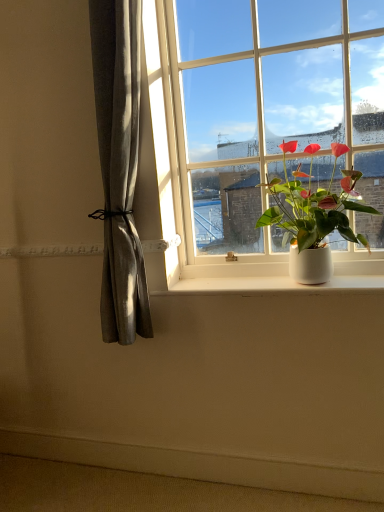
The width and height of the screenshot is (384, 512). Find the location of `white glossy window at upper center`. white glossy window at upper center is located at coordinates (252, 120).

Find the location of `green matte plant at right`. green matte plant at right is located at coordinates (313, 214).

Image resolution: width=384 pixels, height=512 pixels. Find the location of `white smooth ledge at lower center`. white smooth ledge at lower center is located at coordinates (200, 465).

At what (x,y) coordinates should I click in order to perform the action: click on white smooth window sill at lower center. Please return your answer as a coordinate pair (x, y). The height and width of the screenshot is (512, 384). Looking at the image, I should click on (275, 284).

At what (x,y) coordinates should I click in order to perform the action: click on white glossy window at upper center. Please return your answer as a coordinate pair (x, y). The height and width of the screenshot is (512, 384). Looking at the image, I should click on (252, 120).

Is white smooth ledge at lower center outside of white glossy window at upper center?

Yes.

Are white smooth ledge at lower center and white glossy window at upper center far apart?

Yes, white smooth ledge at lower center is far from white glossy window at upper center.

Is white smooth ledge at lower center facing towards white glossy window at upper center?

No, white smooth ledge at lower center does not turn towards white glossy window at upper center.

What are the coordinates of `window in front of the white smooth ledge at lower center` in the screenshot? It's located at 252,120.

Can we say white glossy window at upper center lies outside white smooth ledge at lower center?

Yes, white glossy window at upper center is located beyond the bounds of white smooth ledge at lower center.

Which object is positioned more to the left, white glossy window at upper center or white smooth ledge at lower center?

From the viewer's perspective, white smooth ledge at lower center appears more on the left side.

Could you tell me if white glossy window at upper center is turned towards white smooth ledge at lower center?

No.

From the image's perspective, is white glossy window at upper center on top of white smooth ledge at lower center?

Yes, from the image's perspective, white glossy window at upper center is over white smooth ledge at lower center.

Is white smooth window sill at lower center located outside white glossy window at upper center?

white smooth window sill at lower center is positioned outside white glossy window at upper center.

From the image's perspective, is white smooth window sill at lower center located beneath white glossy window at upper center?

Yes.

Identify the location of window sill below the white glossy window at upper center (from the image's perspective). This screenshot has width=384, height=512. (275, 284).

Considering the positions of objects white smooth window sill at lower center and white glossy window at upper center in the image provided, who is more to the left, white smooth window sill at lower center or white glossy window at upper center?

Positioned to the left is white smooth window sill at lower center.

Locate an element on the screen. This screenshot has height=512, width=384. houseplant in front of the white smooth window sill at lower center is located at coordinates tap(313, 214).

From a real-world perspective, between white smooth window sill at lower center and green matte plant at right, who is vertically lower?

white smooth window sill at lower center.

From the picture: Who is more distant, white smooth window sill at lower center or green matte plant at right?

white smooth window sill at lower center.

Would you consider white glossy window at upper center to be distant from white smooth window sill at lower center?

No, there isn't a large distance between white glossy window at upper center and white smooth window sill at lower center.

Would you say white glossy window at upper center is inside or outside white smooth window sill at lower center?

white glossy window at upper center is spatially situated outside white smooth window sill at lower center.

In the image, there is a white glossy window at upper center. Where is `window sill below it (from the image's perspective)`? The width and height of the screenshot is (384, 512). window sill below it (from the image's perspective) is located at coordinates (275, 284).

Is white glossy window at upper center smaller than white smooth window sill at lower center?

No, white glossy window at upper center is not smaller than white smooth window sill at lower center.

From the image's perspective, is white glossy window at upper center located beneath green matte plant at right?

Incorrect, from the image's perspective, white glossy window at upper center is higher than green matte plant at right.

Is white glossy window at upper center not inside green matte plant at right?

white glossy window at upper center lies outside green matte plant at right's area.

Is white glossy window at upper center further to camera compared to green matte plant at right?

Yes, white glossy window at upper center is further from the viewer.

From a real-world perspective, is white glossy window at upper center over green matte plant at right?

Yes, from a real-world perspective, white glossy window at upper center is over green matte plant at right

Is there a large distance between white smooth ledge at lower center and green matte plant at right?

No, there isn't a large distance between white smooth ledge at lower center and green matte plant at right.

How many degrees apart are the facing directions of white smooth ledge at lower center and green matte plant at right?

0.0397 degrees.

From a real-world perspective, is white smooth ledge at lower center over green matte plant at right?

No, from a real-world perspective, white smooth ledge at lower center is not above green matte plant at right.

Considering the sizes of objects white smooth ledge at lower center and green matte plant at right in the image provided, who is taller, white smooth ledge at lower center or green matte plant at right?

green matte plant at right.

Where is `ledge located behind the white glossy window at upper center`? ledge located behind the white glossy window at upper center is located at coordinates (200, 465).

This screenshot has height=512, width=384. I want to click on window that appears on the right of white smooth ledge at lower center, so click(252, 120).

Estimate the real-world distances between objects in this image. Which object is closer to white glossy window at upper center, green matte plant at right or white smooth window sill at lower center?

green matte plant at right.

From the image, which object appears to be nearer to green matte plant at right, white smooth window sill at lower center or white smooth ledge at lower center?

Based on the image, white smooth window sill at lower center appears to be nearer to green matte plant at right.

Based on their spatial positions, is white glossy window at upper center or white smooth ledge at lower center further from green matte plant at right?

white smooth ledge at lower center is positioned further to the anchor green matte plant at right.

Looking at the image, which one is located closer to green matte plant at right, white glossy window at upper center or white smooth window sill at lower center?

Based on the image, white glossy window at upper center appears to be nearer to green matte plant at right.

When comparing their distances from white smooth ledge at lower center, does white smooth window sill at lower center or green matte plant at right seem further?

green matte plant at right.

Looking at the image, which one is located closer to white glossy window at upper center, white smooth ledge at lower center or white smooth window sill at lower center?

The object closer to white glossy window at upper center is white smooth window sill at lower center.

From the image, which object appears to be farther from white glossy window at upper center, green matte plant at right or white smooth ledge at lower center?

white smooth ledge at lower center.

Considering their positions, is white glossy window at upper center positioned closer to white smooth ledge at lower center than white smooth window sill at lower center?

Among the two, white smooth window sill at lower center is located nearer to white smooth ledge at lower center.

Where is `window sill between green matte plant at right and white smooth ledge at lower center vertically`? The image size is (384, 512). window sill between green matte plant at right and white smooth ledge at lower center vertically is located at coordinates (275, 284).

The image size is (384, 512). Identify the location of houseplant between white glossy window at upper center and white smooth ledge at lower center vertically. (313, 214).

Where is `window sill between white glossy window at upper center and white smooth ledge at lower center from top to bottom`? The image size is (384, 512). window sill between white glossy window at upper center and white smooth ledge at lower center from top to bottom is located at coordinates (275, 284).

Image resolution: width=384 pixels, height=512 pixels. Find the location of `houseplant between white glossy window at upper center and white smooth window sill at lower center in the up-down direction`. houseplant between white glossy window at upper center and white smooth window sill at lower center in the up-down direction is located at coordinates (313, 214).